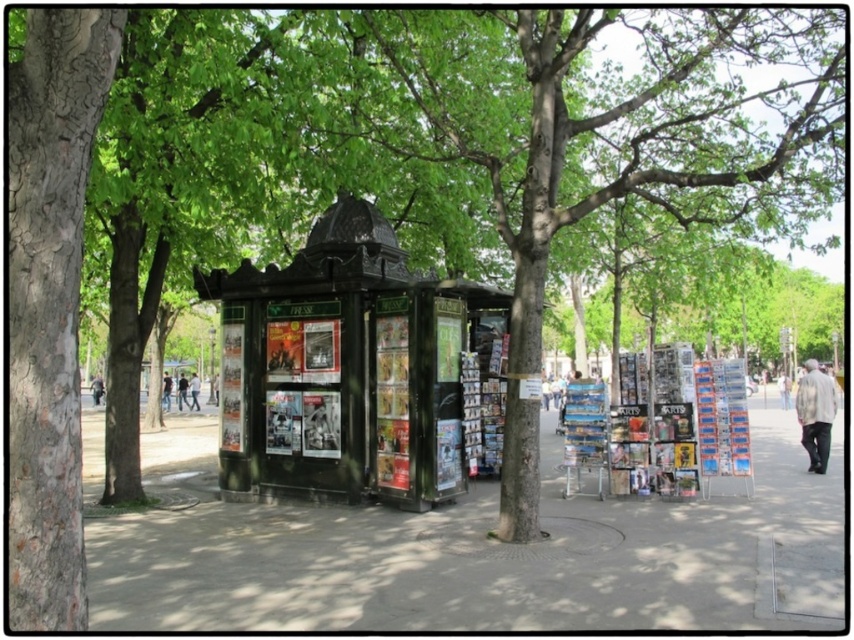
Question: Can you confirm if smooth concrete sidewalk at center is positioned above smooth gray bark at left?

Choices:
 (A) no
 (B) yes

Answer: (A)

Question: Does smooth concrete sidewalk at center appear under smooth gray bark at left?

Choices:
 (A) no
 (B) yes

Answer: (B)

Question: Estimate the real-world distances between objects in this image. Which object is closer to the smooth concrete sidewalk at center?

Choices:
 (A) black glossy kiosk at center
 (B) smooth gray bark at left

Answer: (A)

Question: Which point is closer to the camera taking this photo?

Choices:
 (A) (230, 484)
 (B) (85, 154)
 (C) (838, 538)

Answer: (B)

Question: Which of these objects is positioned farthest from the smooth concrete sidewalk at center?

Choices:
 (A) smooth gray bark at left
 (B) black glossy kiosk at center

Answer: (A)

Question: Can you confirm if smooth concrete sidewalk at center is positioned to the right of smooth gray bark at left?

Choices:
 (A) yes
 (B) no

Answer: (A)